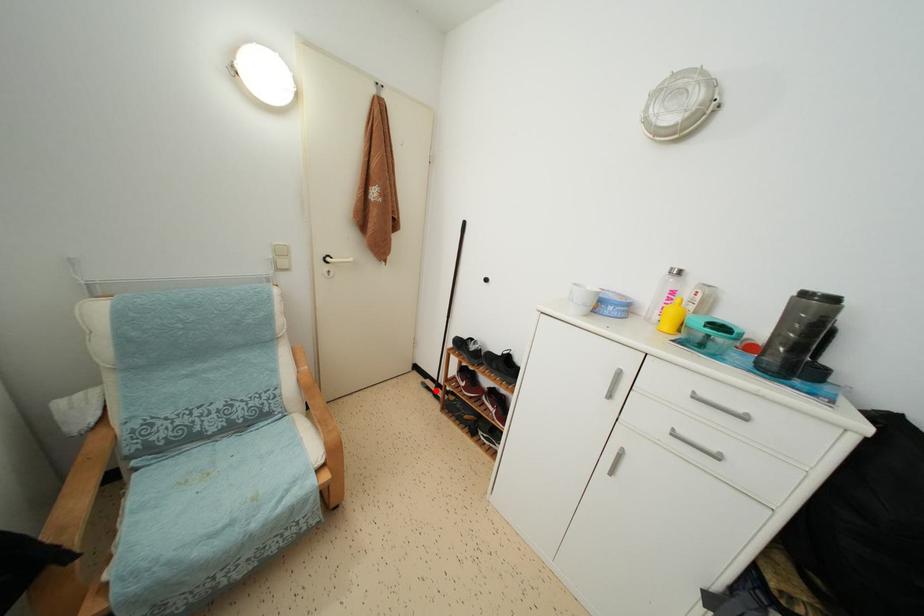
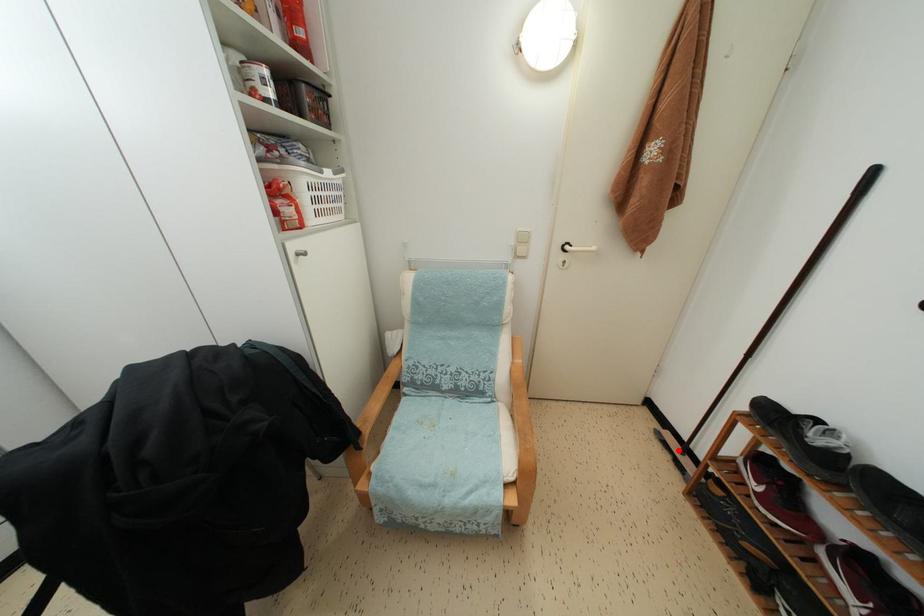
I am providing you with two images of the same scene from different viewpoints. A red point is marked on the first image and another point is marked on the second image. Are the points marked in image1 and image2 representing the same 3D position?

Yes